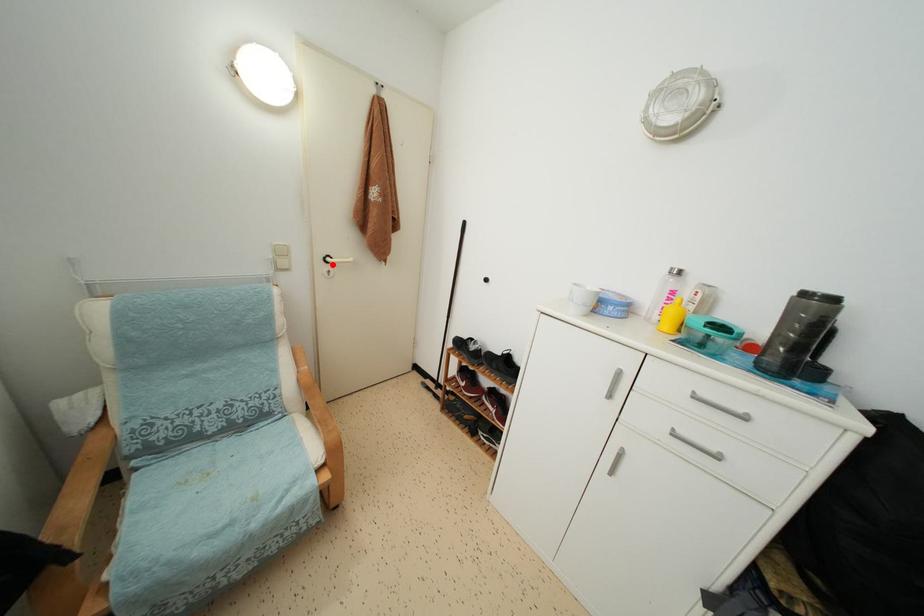
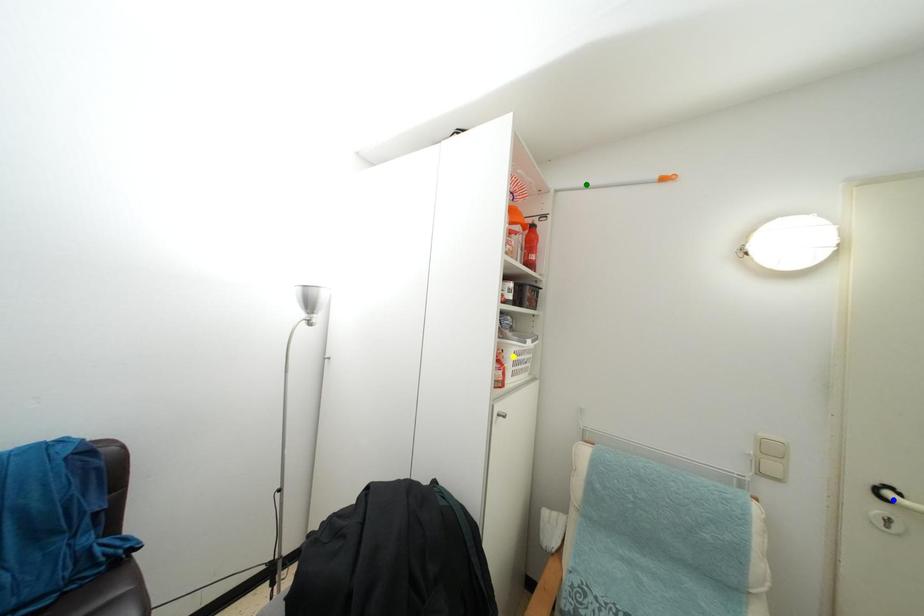
Question: I am providing you with two images of the same scene from different viewpoints. A red point is marked on the first image. You are given multiple points on the second image. Which spot in image 2 lines up with the point in image 1?

Choices:
 (A) yellow point
 (B) blue point
 (C) green point

Answer: (B)